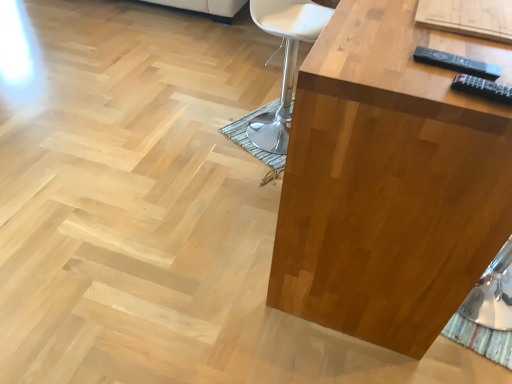
Image resolution: width=512 pixels, height=384 pixels. Identify the location of vacant space situated on the left part of satin wood table at right. (163, 193).